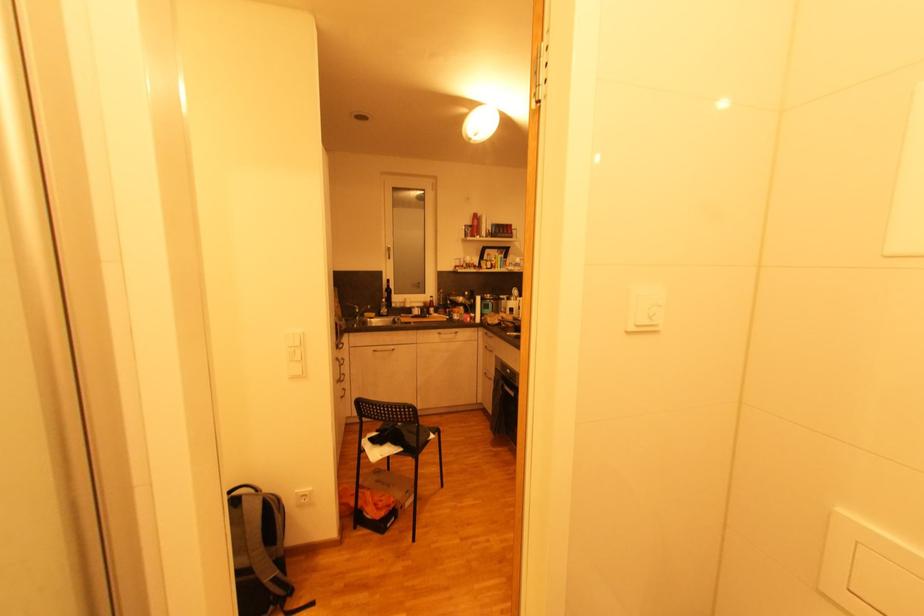
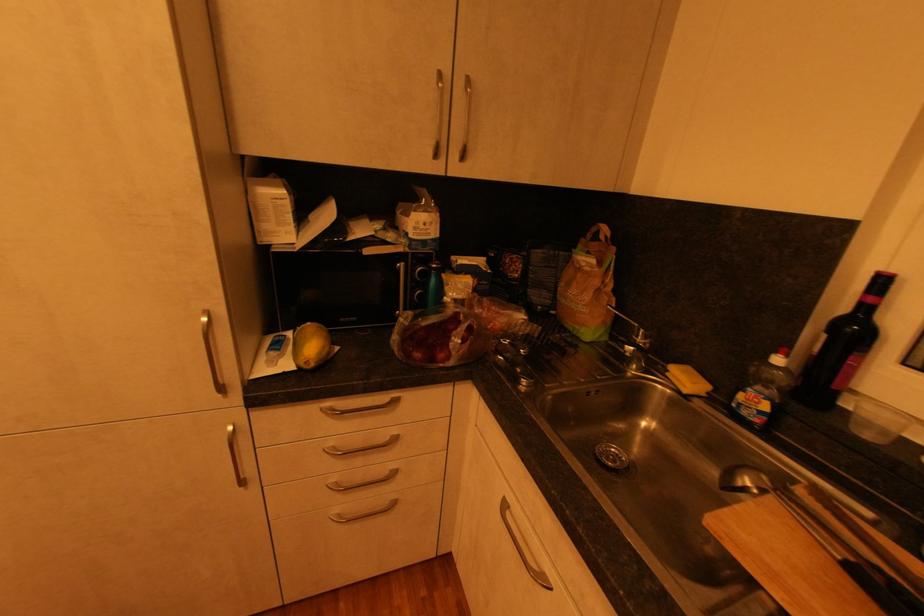
In the second image, find the point that corresponds to point (369, 315) in the first image.

(672, 371)